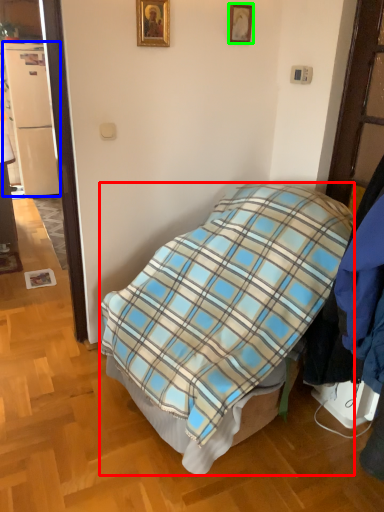
Question: Which is farther away from bed (highlighted by a red box)? refrigerator (highlighted by a blue box) or picture frame (highlighted by a green box)?

Choices:
 (A) refrigerator
 (B) picture frame

Answer: (A)